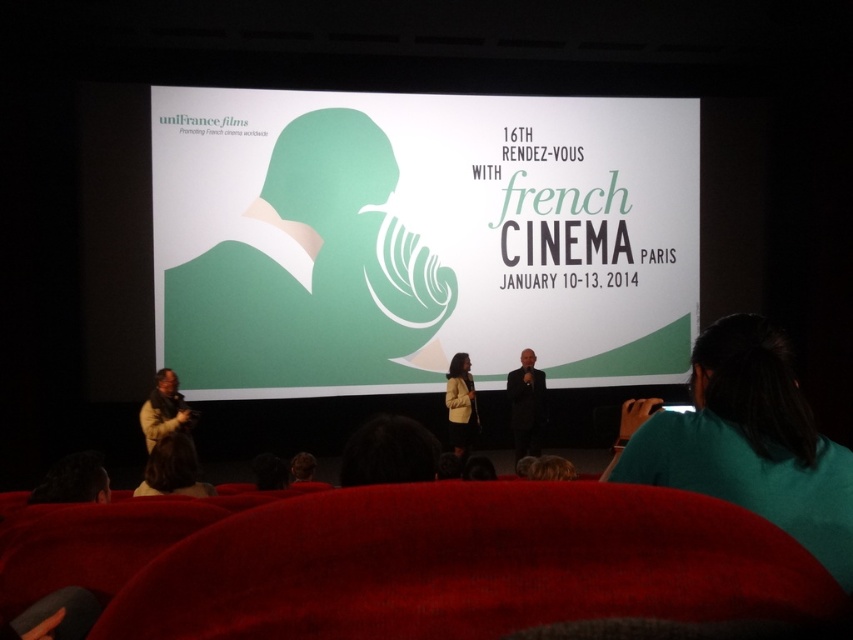
Question: Which point appears closest to the camera in this image?

Choices:
 (A) (177, 380)
 (B) (514, 400)
 (C) (685, 420)
 (D) (468, 403)

Answer: (C)

Question: Can you confirm if green paper at center is positioned above light brown leather jacket at center?

Choices:
 (A) no
 (B) yes

Answer: (B)

Question: Which object is positioned closest to the black suit at center?

Choices:
 (A) green matte shirt at lower right
 (B) light brown leather jacket at center

Answer: (B)

Question: Which of these objects is positioned farthest from the light brown leather jacket at center?

Choices:
 (A) green paper at center
 (B) green matte shirt at lower right

Answer: (B)

Question: Does green paper at center appear over brown textured coat at left?

Choices:
 (A) yes
 (B) no

Answer: (A)

Question: Does brown textured coat at left appear on the right side of light brown leather jacket at center?

Choices:
 (A) no
 (B) yes

Answer: (A)